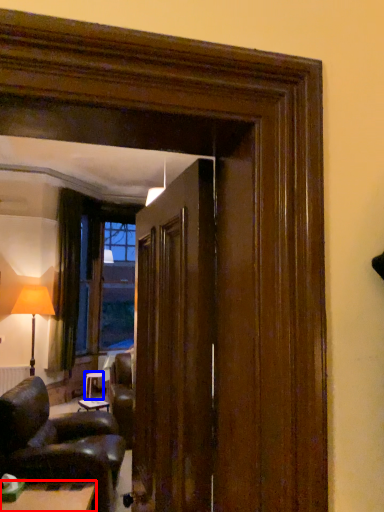
Question: Which object is closer to the camera taking this photo, table (highlighted by a red box) or table (highlighted by a blue box)?

Choices:
 (A) table
 (B) table

Answer: (A)